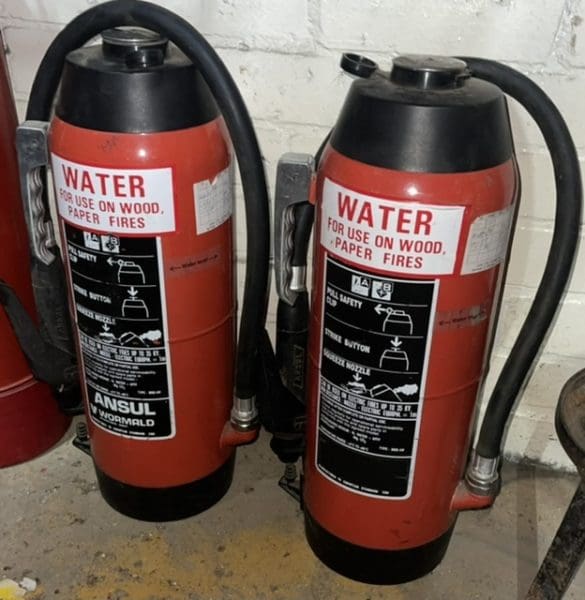
Where is `wall`? wall is located at coordinates click(285, 89).